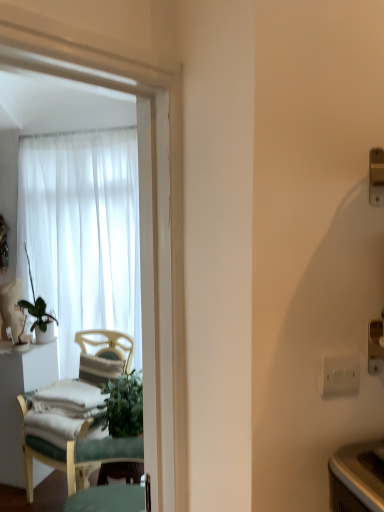
Question: Is green fabric chair at left beside white fabric desk at left?

Choices:
 (A) no
 (B) yes

Answer: (A)

Question: Could white fabric desk at left be considered to be inside green fabric chair at left?

Choices:
 (A) yes
 (B) no

Answer: (B)

Question: From the image's perspective, is green fabric chair at left below white fabric desk at left?

Choices:
 (A) yes
 (B) no

Answer: (B)

Question: Considering the relative positions of green fabric chair at left and white fabric desk at left in the image provided, is green fabric chair at left in front of white fabric desk at left?

Choices:
 (A) no
 (B) yes

Answer: (B)

Question: Does green fabric chair at left have a lesser width compared to white fabric desk at left?

Choices:
 (A) no
 (B) yes

Answer: (A)

Question: Is green fabric chair at left to the left of white fabric desk at left from the viewer's perspective?

Choices:
 (A) yes
 (B) no

Answer: (B)

Question: Could you tell me if green fabric chair at left is facing white plastic electric outlet at right?

Choices:
 (A) yes
 (B) no

Answer: (B)

Question: Is green fabric chair at left located outside white plastic electric outlet at right?

Choices:
 (A) yes
 (B) no

Answer: (A)

Question: Considering the relative sizes of green fabric chair at left and white plastic electric outlet at right in the image provided, is green fabric chair at left taller than white plastic electric outlet at right?

Choices:
 (A) yes
 (B) no

Answer: (A)

Question: Would you say green fabric chair at left contains white plastic electric outlet at right?

Choices:
 (A) yes
 (B) no

Answer: (B)

Question: Is green fabric chair at left wider than white plastic electric outlet at right?

Choices:
 (A) no
 (B) yes

Answer: (B)

Question: Is green fabric chair at left with white plastic electric outlet at right?

Choices:
 (A) yes
 (B) no

Answer: (B)

Question: Is white sheer curtain at upper left at the left side of green fabric chair at left?

Choices:
 (A) yes
 (B) no

Answer: (A)